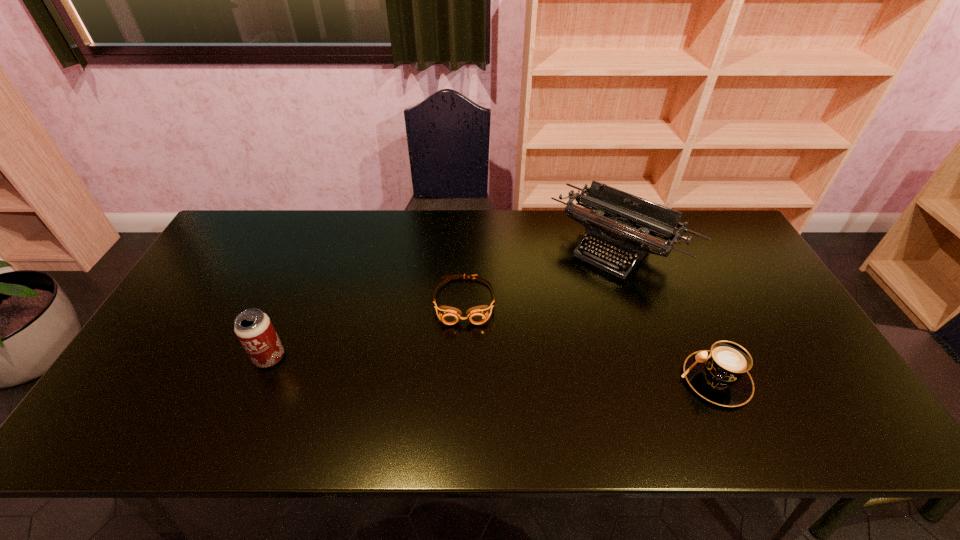
Find the location of a particular element. This screenshot has width=960, height=540. vacant point at the near left corner is located at coordinates 171,393.

The image size is (960, 540). In order to click on blank region between the goggles and the cappuccino in this screenshot , I will do `click(589, 341)`.

Locate an element on the screen. The image size is (960, 540). free space between the leftmost object and the second shortest object is located at coordinates (492, 369).

You are a GUI agent. You are given a task and a screenshot of the screen. Output one action in this format:
    pyautogui.click(x=<x>, y=<y>)
    Task: Click on the vacant area that lies between the typewriter and the second shortest object
    Image resolution: width=960 pixels, height=540 pixels.
    Given the screenshot: What is the action you would take?
    pyautogui.click(x=666, y=313)

The width and height of the screenshot is (960, 540). Identify the location of vacant space that's between the second shortest object and the typewriter. (666, 313).

Identify the location of free space between the beer can and the typewriter. The width and height of the screenshot is (960, 540). (444, 302).

Identify the location of vacant area that lies between the goggles and the typewriter. The image size is (960, 540). click(x=541, y=274).

Where is `blank region between the shortest object and the beer can`? Image resolution: width=960 pixels, height=540 pixels. blank region between the shortest object and the beer can is located at coordinates (367, 329).

Locate an element on the screen. vacant space that is in between the leftmost object and the shortest object is located at coordinates (367, 329).

Locate an element on the screen. empty space that is in between the second shortest object and the typewriter is located at coordinates (666, 313).